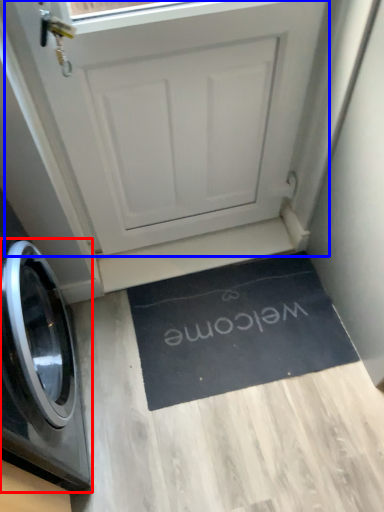
Question: Which of the following is the farthest to the observer, washing machine (highlighted by a red box) or screen door (highlighted by a blue box)?

Choices:
 (A) washing machine
 (B) screen door

Answer: (B)